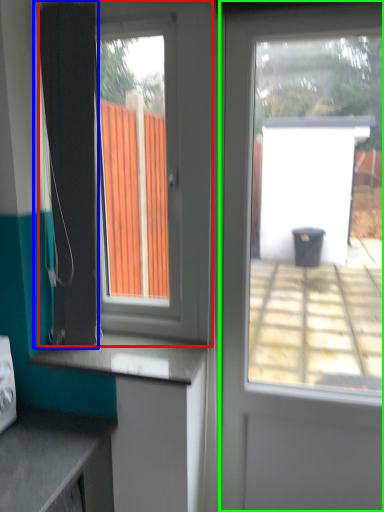
Question: Estimate the real-world distances between objects in this image. Which object is farther from window (highlighted by a red box), shower curtain (highlighted by a blue box) or door (highlighted by a green box)?

Choices:
 (A) shower curtain
 (B) door

Answer: (B)